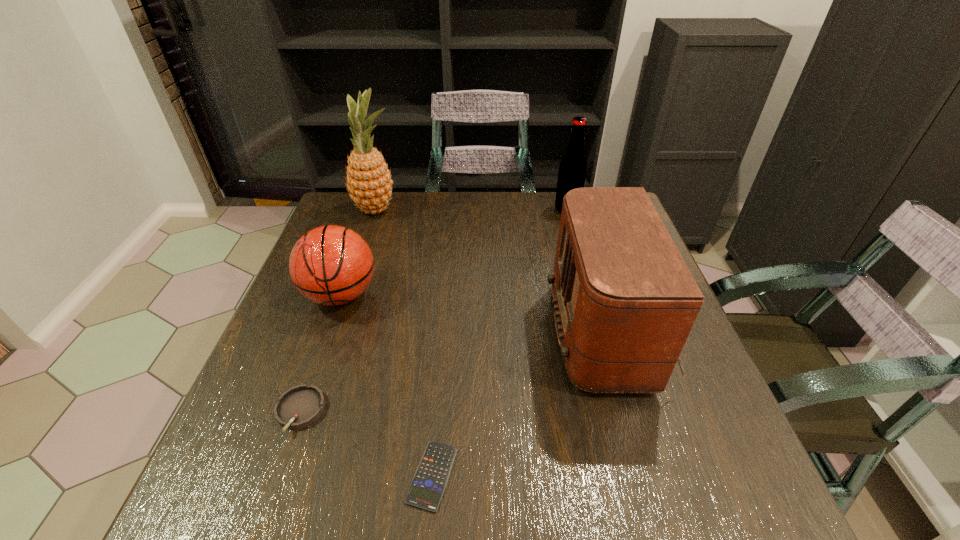
The width and height of the screenshot is (960, 540). Find the location of `pineapple`. pineapple is located at coordinates (369, 181).

Image resolution: width=960 pixels, height=540 pixels. Identify the location of beer bottle. (572, 169).

Locate an element on the screen. The image size is (960, 540). radio receiver is located at coordinates (625, 301).

Where is `basketball`? This screenshot has height=540, width=960. basketball is located at coordinates (331, 265).

At what (x,y) coordinates should I click in order to perform the action: click on the fifth tallest object. Please return your answer as a coordinate pair (x, y). The image size is (960, 540). Looking at the image, I should click on tap(300, 406).

The image size is (960, 540). Find the location of `the shortest object`. the shortest object is located at coordinates (429, 482).

Image resolution: width=960 pixels, height=540 pixels. I want to click on the nearest object, so click(429, 482).

Where is `free region located 0.170m on the right of the pineapple`? The width and height of the screenshot is (960, 540). free region located 0.170m on the right of the pineapple is located at coordinates (456, 210).

Locate an element on the screen. The image size is (960, 540). vacant region located 0.090m on the front of the beer bottle is located at coordinates (574, 234).

Where is `vacant space positioned on the front panel of the radio receiver`? vacant space positioned on the front panel of the radio receiver is located at coordinates (437, 333).